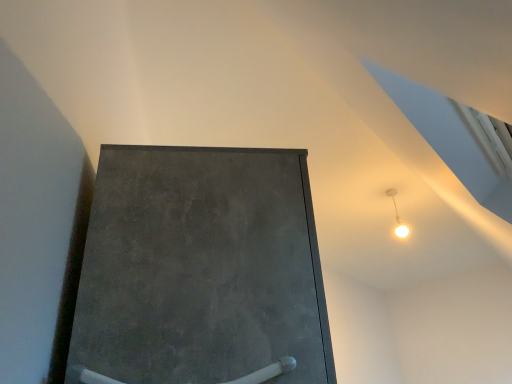
The height and width of the screenshot is (384, 512). Describe the element at coordinates (397, 216) in the screenshot. I see `matte white lamp at upper right` at that location.

Where is `matte white lamp at upper right`? matte white lamp at upper right is located at coordinates (397, 216).

The width and height of the screenshot is (512, 384). I want to click on matte white lamp at upper right, so click(397, 216).